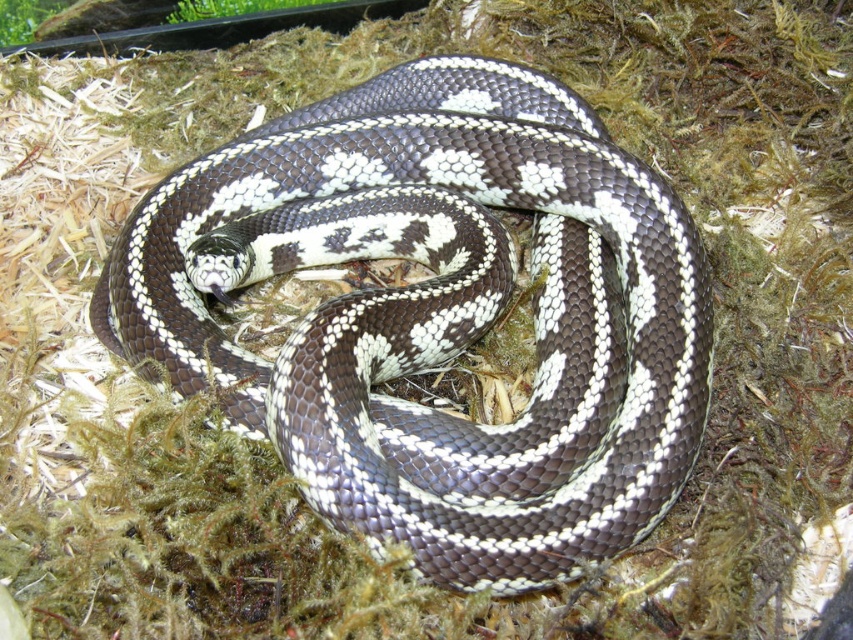
Which is in front, point (474, 276) or point (16, 28)?

Positioned in front is point (474, 276).

Who is more distant from viewer, (282, 403) or (50, 6)?

The point (50, 6) is more distant.

The image size is (853, 640). In order to click on shiny brown snake at center in this screenshot , I will do pos(432,336).

Is point (276, 3) less distant than point (3, 45)?

No, it is behind (3, 45).

Is green mossy grass at upper center taller than green mossy grass at upper left?

In fact, green mossy grass at upper center may be shorter than green mossy grass at upper left.

I want to click on green mossy grass at upper center, so (x=233, y=8).

Is point (701, 420) positioned in front of point (202, 3)?

Yes, it is in front of point (202, 3).

Is point (297, 401) positioned behind point (229, 12)?

No, (297, 401) is closer to viewer.

The width and height of the screenshot is (853, 640). I want to click on shiny brown snake at center, so click(x=432, y=336).